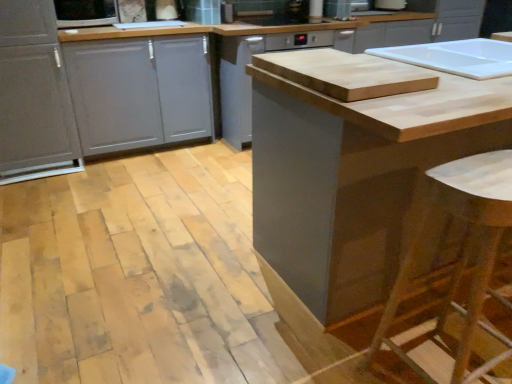
What are the coordinates of `matte gray dishwasher at center, the 2th cabinetry when ordered from right to left` in the screenshot? It's located at (249, 77).

Locate an element on the screen. wooden bar stool at lower right is located at coordinates (459, 258).

Describe the element at coordinates (390, 5) in the screenshot. The image size is (512, 384). I see `metallic silver dishwasher at upper center` at that location.

At what (x,y) coordinates should I click in order to perform the action: click on natural wood cutting board at center. Please return your answer as a coordinate pair (x, y). This screenshot has width=512, height=384. Looking at the image, I should click on (344, 74).

This screenshot has height=384, width=512. What do you see at coordinates (344, 74) in the screenshot?
I see `natural wood cutting board at center` at bounding box center [344, 74].

Identify the location of matte gray drawer at left. (139, 91).

At what (x,y) coordinates should I click in order to perform the action: click on matte white microwave at upper left. Please return your answer as a coordinate pair (x, y). Image resolution: width=512 pixels, height=384 pixels. Looking at the image, I should click on (85, 13).

Considering the sizes of objects matte gray cabinet at center, which ranks as the 1th cabinetry in right-to-left order, and matte gray dishwasher at center, the 2th cabinetry when ordered from left to right, in the image provided, who is thinner, matte gray cabinet at center, which ranks as the 1th cabinetry in right-to-left order, or matte gray dishwasher at center, the 2th cabinetry when ordered from left to right,?

With smaller width is matte gray cabinet at center, which ranks as the 1th cabinetry in right-to-left order.

Is the position of matte gray cabinet at center, the third cabinetry viewed from the left, less distant than that of matte gray dishwasher at center, the 2th cabinetry when ordered from left to right?

Yes, the depth of matte gray cabinet at center, the third cabinetry viewed from the left, is less than that of matte gray dishwasher at center, the 2th cabinetry when ordered from left to right.

Is matte gray cabinet at center, the third cabinetry viewed from the left, taller or shorter than matte gray dishwasher at center, the 2th cabinetry when ordered from right to left?

In the image, matte gray cabinet at center, the third cabinetry viewed from the left, appears to be taller than matte gray dishwasher at center, the 2th cabinetry when ordered from right to left.

Is matte gray cabinet at center, which ranks as the 1th cabinetry in right-to-left order, inside or outside of matte gray dishwasher at center, the 2th cabinetry when ordered from left to right?

matte gray cabinet at center, which ranks as the 1th cabinetry in right-to-left order, is not inside matte gray dishwasher at center, the 2th cabinetry when ordered from left to right, it's outside.

Is wooden bar stool at lower right at the back of metallic silver dishwasher at upper center?

No, metallic silver dishwasher at upper center is not facing away from wooden bar stool at lower right.

From a real-world perspective, relative to wooden bar stool at lower right, is metallic silver dishwasher at upper center vertically above or below?

In terms of real-world spatial position, metallic silver dishwasher at upper center is above wooden bar stool at lower right.

Between metallic silver dishwasher at upper center and wooden bar stool at lower right, which one has smaller width?

Thinner between the two is metallic silver dishwasher at upper center.

Which object is positioned more to the right, matte gray drawer at left or natural wood cutting board at center?

Positioned to the right is natural wood cutting board at center.

Is matte gray drawer at left turned away from natural wood cutting board at center?

No, matte gray drawer at left's orientation is not away from natural wood cutting board at center.

Does point (189, 88) appear closer or farther from the camera than point (399, 67)?

Point (189, 88) appears to be farther away from the viewer than point (399, 67).

Would you say metallic silver dishwasher at upper center is part of matte gray dishwasher at center, the 2th cabinetry when ordered from right to left,'s contents?

No, matte gray dishwasher at center, the 2th cabinetry when ordered from right to left, does not contain metallic silver dishwasher at upper center.

Does point (226, 48) come behind point (375, 2)?

No.

From a real-world perspective, which is physically above, matte gray dishwasher at center, the 2th cabinetry when ordered from left to right, or metallic silver dishwasher at upper center?

From a 3D spatial view, metallic silver dishwasher at upper center is above.

Can you see matte gray dishwasher at center, the 2th cabinetry when ordered from left to right, touching metallic silver dishwasher at upper center?

matte gray dishwasher at center, the 2th cabinetry when ordered from left to right, and metallic silver dishwasher at upper center are not in contact.

From a real-world perspective, who is located lower, matte gray drawer at left or wooden bar stool at lower right?

wooden bar stool at lower right.

From the image's perspective, which one is positioned higher, matte gray drawer at left or wooden bar stool at lower right?

From the image's view, matte gray drawer at left is above.

Is point (115, 54) positioned behind point (399, 280)?

Yes, it is behind point (399, 280).

Considering the sizes of objects matte gray drawer at left and wooden bar stool at lower right in the image provided, who is wider, matte gray drawer at left or wooden bar stool at lower right?

matte gray drawer at left.

Could you tell me if matte white microwave at upper left is turned towards metallic silver dishwasher at upper center?

No, matte white microwave at upper left does not turn towards metallic silver dishwasher at upper center.

Can you tell me how much matte white microwave at upper left and metallic silver dishwasher at upper center differ in facing direction?

The angle between the facing direction of matte white microwave at upper left and the facing direction of metallic silver dishwasher at upper center is 39.4 degrees.

Between matte white microwave at upper left and metallic silver dishwasher at upper center, which one is positioned in front?

matte white microwave at upper left is more forward.

Between matte white microwave at upper left and metallic silver dishwasher at upper center, which one appears on the right side from the viewer's perspective?

From the viewer's perspective, metallic silver dishwasher at upper center appears more on the right side.

Is natural wood cutting board at center oriented away from metallic silver dishwasher at upper center?

No.

Does point (297, 56) lie behind point (392, 3)?

That is False.

From the picture: Is natural wood cutting board at center next to metallic silver dishwasher at upper center and touching it?

They are not placed beside each other.

Considering the sizes of natural wood cutting board at center and metallic silver dishwasher at upper center in the image, is natural wood cutting board at center taller or shorter than metallic silver dishwasher at upper center?

Clearly, natural wood cutting board at center is shorter compared to metallic silver dishwasher at upper center.

Locate an element on the screen. The height and width of the screenshot is (384, 512). the 1st cabinetry counting from the left of the matte gray cabinet at center, the third cabinetry viewed from the left is located at coordinates (249, 77).

In the image, there is a metallic silver dishwasher at upper center. Where is `bar stool below it (from the image's perspective)`? bar stool below it (from the image's perspective) is located at coordinates (459, 258).

Looking at the image, which one is located closer to matte gray cabinet at left, the 1th cabinetry when ordered from left to right, matte white microwave at upper left or natural wood cutting board at center?

Based on the image, matte white microwave at upper left appears to be nearer to matte gray cabinet at left, the 1th cabinetry when ordered from left to right.

Based on the photo, looking at the image, which one is located further to matte white microwave at upper left, matte gray cabinet at left, arranged as the third cabinetry when viewed from the right, or natural wood cutting board at center?

The object further to matte white microwave at upper left is natural wood cutting board at center.

Based on their spatial positions, is matte gray dishwasher at center, the 2th cabinetry when ordered from left to right, or matte gray cabinet at center, which ranks as the 1th cabinetry in right-to-left order, closer to natural wood cutting board at center?

matte gray cabinet at center, which ranks as the 1th cabinetry in right-to-left order, is positioned closer to the anchor natural wood cutting board at center.

Which object lies nearer to the anchor point matte white microwave at upper left, matte gray cabinet at center, the third cabinetry viewed from the left, or natural wood cutting board at center?

The object closer to matte white microwave at upper left is natural wood cutting board at center.

Estimate the real-world distances between objects in this image. Which object is closer to matte white microwave at upper left, natural wood cutting board at center or matte gray cabinet at center, which ranks as the 1th cabinetry in right-to-left order?

natural wood cutting board at center is positioned closer to the anchor matte white microwave at upper left.

Considering their positions, is matte gray dishwasher at center, the 2th cabinetry when ordered from right to left, positioned further to natural wood cutting board at center than matte white microwave at upper left?

matte white microwave at upper left is positioned further to the anchor natural wood cutting board at center.

Considering their positions, is natural wood cutting board at center positioned closer to wooden bar stool at lower right than matte white microwave at upper left?

natural wood cutting board at center is positioned closer to the anchor wooden bar stool at lower right.

Considering their positions, is matte gray cabinet at left, arranged as the third cabinetry when viewed from the right, positioned closer to matte white microwave at upper left than wooden bar stool at lower right?

Among the two, matte gray cabinet at left, arranged as the third cabinetry when viewed from the right, is located nearer to matte white microwave at upper left.

Locate an element on the screen. home appliance between natural wood cutting board at center and matte gray dishwasher at center, the 2th cabinetry when ordered from left to right, along the z-axis is located at coordinates (85, 13).

Where is `cutting board between wooden bar stool at lower right and matte gray drawer at left in the front-back direction`? The height and width of the screenshot is (384, 512). cutting board between wooden bar stool at lower right and matte gray drawer at left in the front-back direction is located at coordinates (344, 74).

At what (x,y) coordinates should I click in order to perform the action: click on cabinetry located between matte gray cabinet at left, the 1th cabinetry when ordered from left to right, and natural wood cutting board at center in the left-right direction. Please return your answer as a coordinate pair (x, y). The width and height of the screenshot is (512, 384). Looking at the image, I should click on (249, 77).

The height and width of the screenshot is (384, 512). In order to click on cabinetry between natural wood cutting board at center and wooden bar stool at lower right in the up-down direction in this screenshot , I will do `click(354, 165)`.